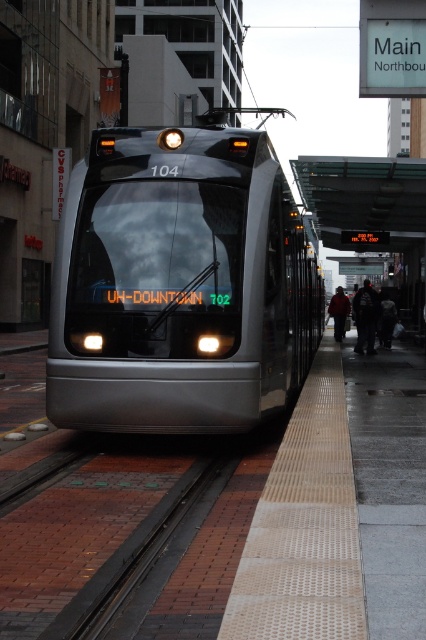
Question: Which point is closer to the camera taking this photo?

Choices:
 (A) (394, 492)
 (B) (287, 273)
 (C) (367, 330)
 (D) (334, 296)

Answer: (A)

Question: Which of the following is the closest to the observer?

Choices:
 (A) perforated beige platform at center
 (B) polished metal train at center

Answer: (A)

Question: Where is perforated beige platform at center located in relation to dark gray jacket at center in the image?

Choices:
 (A) above
 (B) below

Answer: (B)

Question: Among these points, which one is nearest to the camera?

Choices:
 (A) (374, 353)
 (B) (161, 340)

Answer: (B)

Question: Does polished metal train at center have a lesser width compared to perforated beige platform at center?

Choices:
 (A) no
 (B) yes

Answer: (B)

Question: From the image, what is the correct spatial relationship of black fabric commuter at center in relation to dark gray jacket at center?

Choices:
 (A) above
 (B) below

Answer: (B)